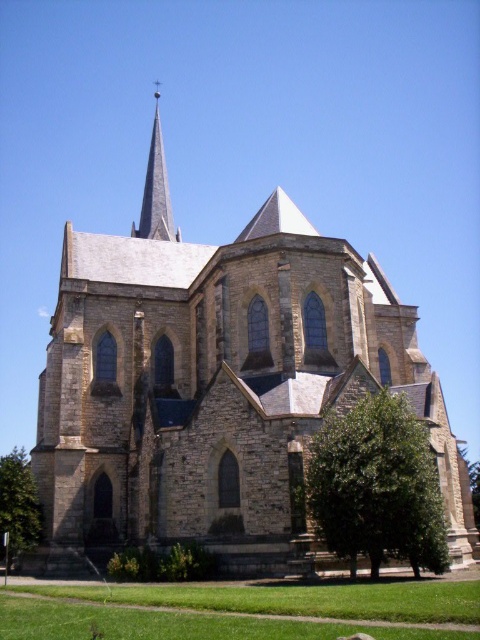
Question: Which object appears closest to the camera in this image?

Choices:
 (A) green leafy tree at lower right
 (B) smooth gray steeple at upper center

Answer: (A)

Question: Which object is the farthest from the green leafy tree at lower right?

Choices:
 (A) brown stone church at center
 (B) smooth gray steeple at upper center
 (C) green leafy tree at lower left

Answer: (B)

Question: Can you confirm if green leafy tree at lower left is wider than smooth gray steeple at upper center?

Choices:
 (A) yes
 (B) no

Answer: (A)

Question: Does brown stone church at center have a greater width compared to green leafy tree at lower right?

Choices:
 (A) no
 (B) yes

Answer: (B)

Question: Can you confirm if brown stone church at center is positioned to the right of green leafy tree at lower right?

Choices:
 (A) no
 (B) yes

Answer: (A)

Question: Considering the real-world distances, which object is farthest from the brown stone church at center?

Choices:
 (A) green leafy tree at lower left
 (B) smooth gray steeple at upper center
 (C) green leafy tree at lower right

Answer: (B)